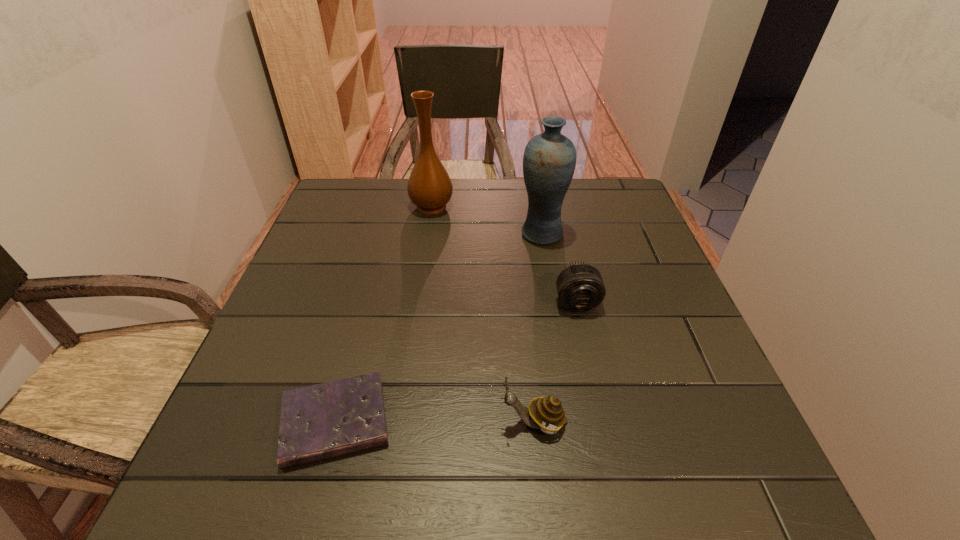
Locate an element on the screen. The width and height of the screenshot is (960, 540). the left vase is located at coordinates (430, 188).

This screenshot has width=960, height=540. Find the location of `the farthest object`. the farthest object is located at coordinates (430, 188).

Where is `the fourth nearest object`? Image resolution: width=960 pixels, height=540 pixels. the fourth nearest object is located at coordinates (549, 161).

The image size is (960, 540). Find the location of `the nearer vase`. the nearer vase is located at coordinates (549, 161).

This screenshot has height=540, width=960. In order to click on the third tallest object in this screenshot , I will do `click(546, 413)`.

This screenshot has height=540, width=960. Identify the location of the third nearest object. (580, 287).

Where is `telephoto lens`? This screenshot has height=540, width=960. telephoto lens is located at coordinates (580, 287).

Where is `diary`? This screenshot has width=960, height=540. diary is located at coordinates (321, 421).

Where is `free space located on the front of the left vase`? The image size is (960, 540). free space located on the front of the left vase is located at coordinates (419, 294).

Identify the location of vacant space situated 0.280m on the left of the second farthest object. This screenshot has height=540, width=960. (414, 234).